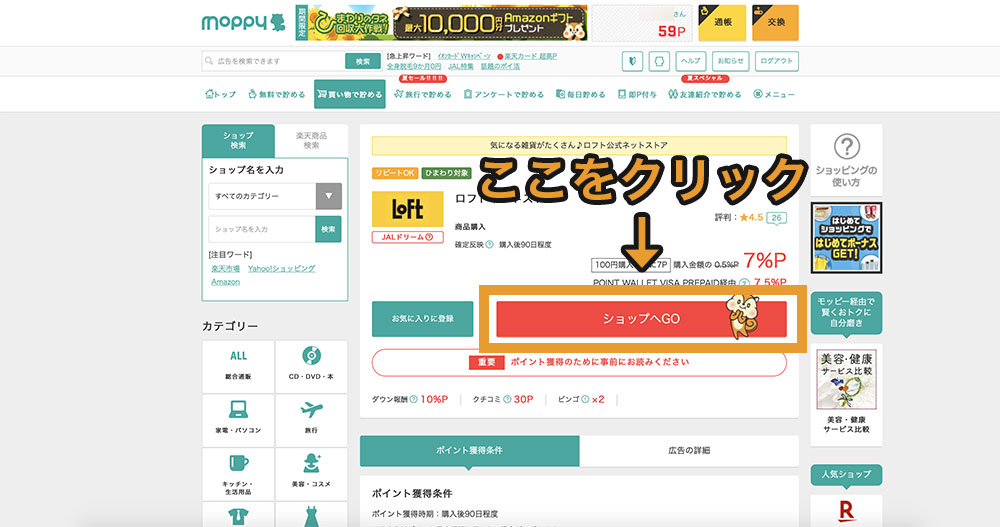
Find the location of `green mug icon`. green mug icon is located at coordinates (235, 458).